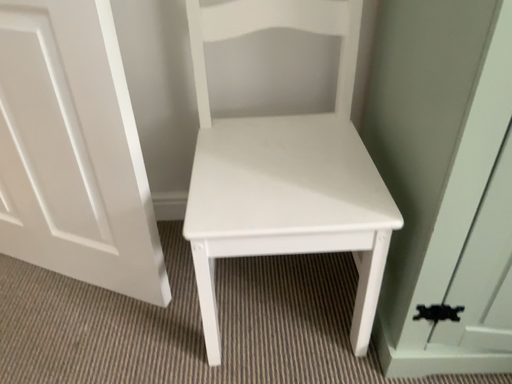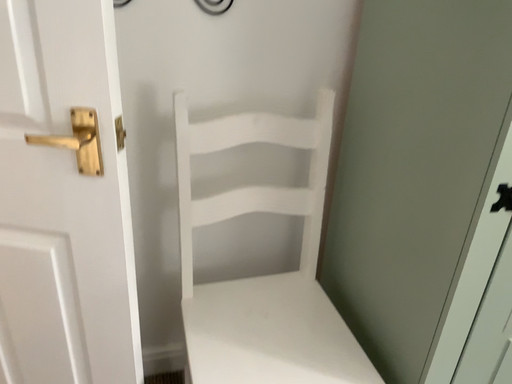
Question: How did the camera likely rotate when shooting the video?

Choices:
 (A) rotated right
 (B) rotated left

Answer: (A)